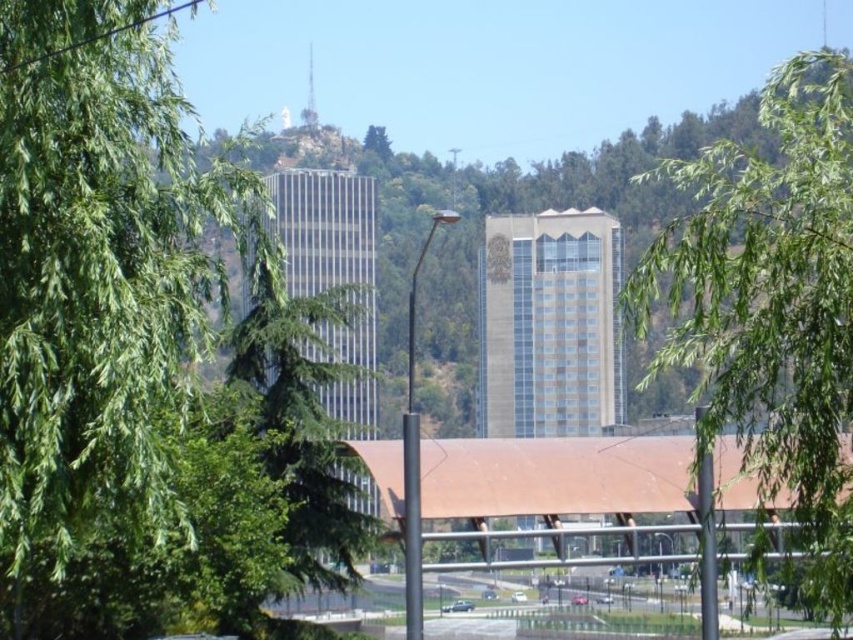
You are standing in the urban landscape scene and want to know which of the two points, point (x=461, y=609) or point (x=514, y=600), is nearer to you. Can you determine this based on their positions?

Point (x=461, y=609) is closer to the viewer than point (x=514, y=600).